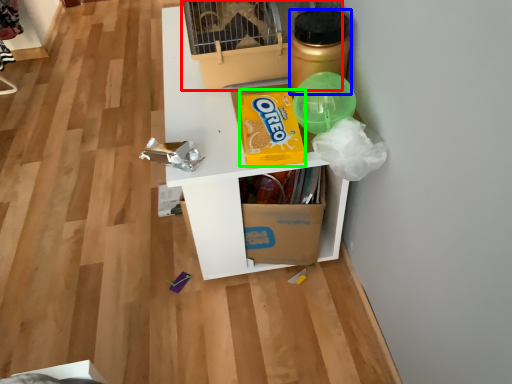
Question: Based on their relative distances, which object is nearer to bird cage (highlighted by a red box)? Choose from bottle (highlighted by a blue box) and cereal (highlighted by a green box).

Choices:
 (A) bottle
 (B) cereal

Answer: (A)